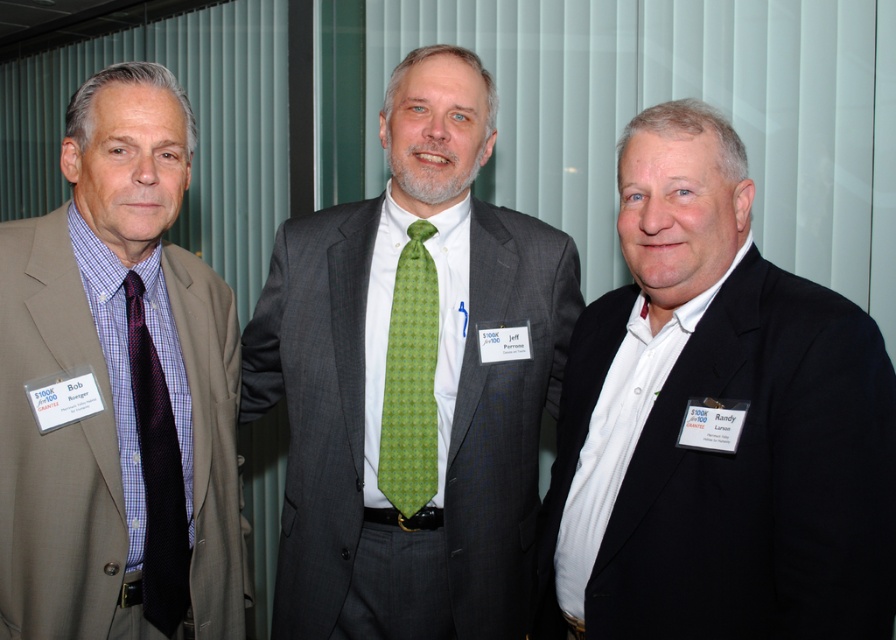
Question: Estimate the real-world distances between objects in this image. Which object is closer to the green printed tie at center?

Choices:
 (A) green textured tie at center
 (B) matte brown suit at left
 (C) dark blue textured tie at left
 (D) white matte shirt at center

Answer: (A)

Question: Which object is closer to the camera taking this photo?

Choices:
 (A) green printed tie at center
 (B) matte brown suit at left

Answer: (B)

Question: Is white matte shirt at center to the right of green printed tie at center from the viewer's perspective?

Choices:
 (A) yes
 (B) no

Answer: (A)

Question: Where is white matte shirt at center located in relation to green printed tie at center in the image?

Choices:
 (A) below
 (B) above

Answer: (A)

Question: Is matte brown suit at left below green printed tie at center?

Choices:
 (A) no
 (B) yes

Answer: (A)

Question: Which of these objects is positioned closest to the dark blue textured tie at left?

Choices:
 (A) matte brown suit at left
 (B) green textured tie at center
 (C) green printed tie at center
 (D) white matte shirt at center

Answer: (A)